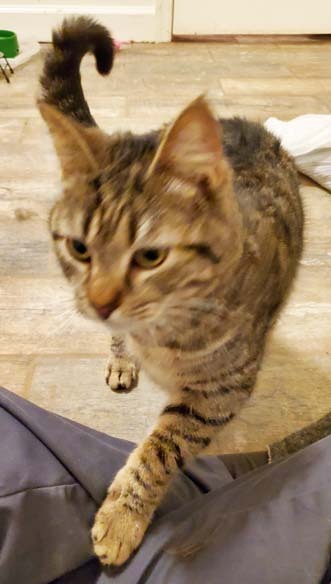
Where is `floor next to cat`? floor next to cat is located at coordinates [x=296, y=395].